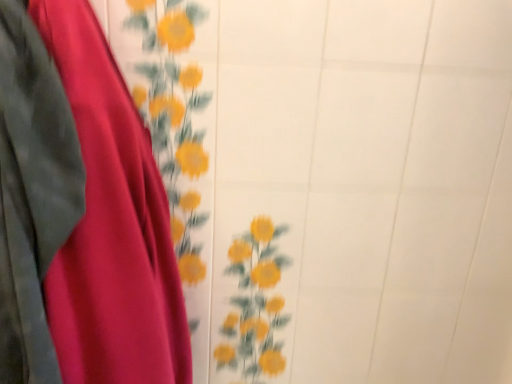
What do you see at coordinates (111, 225) in the screenshot? I see `matte red curtain at left` at bounding box center [111, 225].

In order to face matte red curtain at left, should I rotate leftwards or rightwards?

Rotate your view left by about 24.619°.

Image resolution: width=512 pixels, height=384 pixels. I want to click on matte red curtain at left, so click(x=111, y=225).

Identify the location of matte red curtain at left. The image size is (512, 384). (111, 225).